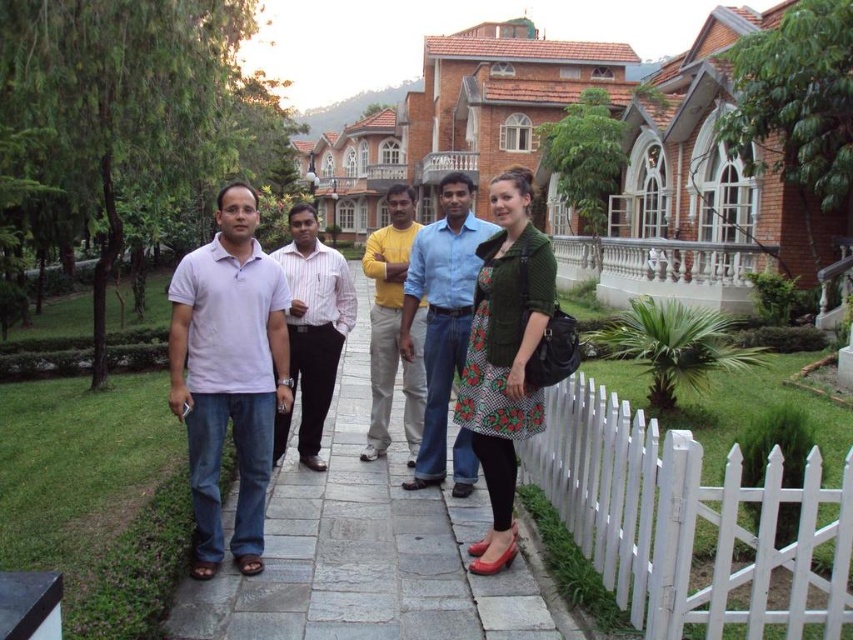
You are a photographer trying to capture a group photo of the striped cotton shirt at center and the yellow cotton shirt at center. Which shirt should you focus on first to ensure it fits entirely within the camera frame?

The striped cotton shirt at center is smaller than the yellow cotton shirt at center, so you should focus on the yellow cotton shirt at center first to ensure it fits entirely within the camera frame since it is larger and requires more space.

You are a photographer trying to capture a group photo of the five people standing on the pathway. You need to ensure that the white wooden fence at lower right and the white matte shirt at center are both visible in the frame. Based on their sizes, which object would require you to adjust your camera angle more to include it in the shot?

The white wooden fence at lower right has a greater width than the white matte shirt at center, so you would need to adjust your camera angle more to include the white wooden fence at lower right in the shot.

You are standing at the point with coordinates point [296,209] and want to walk to point [374,280]. Given that the path is 1 meter wide, will you be able to walk directly to the destination without stepping off the path?

The path is 1 meter wide, so you can walk directly to point [374,280] from point [296,209] without stepping off the path since the distance between them is within the path width.